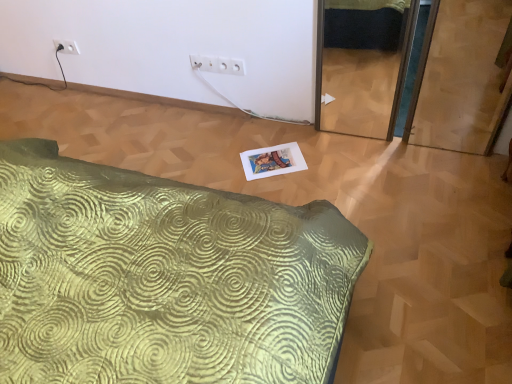
Question: Should I look upward or downward to see green textured bed at lower left?

Choices:
 (A) down
 (B) up

Answer: (B)

Question: Is white plastic outlet at upper center, the second electric outlet in the back-to-front sequence, located within white plastic electric outlet at upper left, placed as the 1th electric outlet when sorted from left to right?

Choices:
 (A) yes
 (B) no

Answer: (B)

Question: Is white plastic outlet at upper center, acting as the first electric outlet starting from the bottom, at the back of white plastic electric outlet at upper left, arranged as the 2th electric outlet when ordered from the bottom?

Choices:
 (A) no
 (B) yes

Answer: (A)

Question: Is white plastic electric outlet at upper left, positioned as the 1th electric outlet in top-to-bottom order, to the left of white plastic outlet at upper center, which ranks as the 2th electric outlet in left-to-right order, from the viewer's perspective?

Choices:
 (A) yes
 (B) no

Answer: (A)

Question: Is white plastic electric outlet at upper left, placed as the first electric outlet when sorted from back to front, not within white plastic outlet at upper center, acting as the first electric outlet starting from the bottom?

Choices:
 (A) no
 (B) yes

Answer: (B)

Question: Does white plastic electric outlet at upper left, arranged as the 2th electric outlet when ordered from the bottom, have a greater height compared to white plastic outlet at upper center, the second electric outlet in the back-to-front sequence?

Choices:
 (A) yes
 (B) no

Answer: (A)

Question: Is white plastic electric outlet at upper left, the second electric outlet positioned from the right, further to camera compared to white plastic outlet at upper center, which appears as the 1th electric outlet when viewed from the right?

Choices:
 (A) yes
 (B) no

Answer: (A)

Question: Can you confirm if green textured bed at lower left is shorter than white plastic electric outlet at upper left, arranged as the 2th electric outlet when ordered from the bottom?

Choices:
 (A) yes
 (B) no

Answer: (A)

Question: Is the position of green textured bed at lower left less distant than that of white plastic electric outlet at upper left, the second electric outlet viewed from the front?

Choices:
 (A) yes
 (B) no

Answer: (A)

Question: Is green textured bed at lower left not near white plastic electric outlet at upper left, placed as the 1th electric outlet when sorted from left to right?

Choices:
 (A) no
 (B) yes

Answer: (B)

Question: From the image's perspective, is green textured bed at lower left on white plastic electric outlet at upper left, placed as the first electric outlet when sorted from back to front?

Choices:
 (A) no
 (B) yes

Answer: (A)

Question: Does green textured bed at lower left appear on the left side of white plastic electric outlet at upper left, arranged as the 2th electric outlet when ordered from the bottom?

Choices:
 (A) no
 (B) yes

Answer: (A)

Question: Is green textured bed at lower left bigger than white plastic electric outlet at upper left, positioned as the 1th electric outlet in top-to-bottom order?

Choices:
 (A) yes
 (B) no

Answer: (A)

Question: Considering the relative sizes of white plastic outlet at upper center, the 2th electric outlet from the top, and white plastic electric outlet at upper left, the second electric outlet positioned from the right, in the image provided, is white plastic outlet at upper center, the 2th electric outlet from the top, wider than white plastic electric outlet at upper left, the second electric outlet positioned from the right,?

Choices:
 (A) yes
 (B) no

Answer: (A)